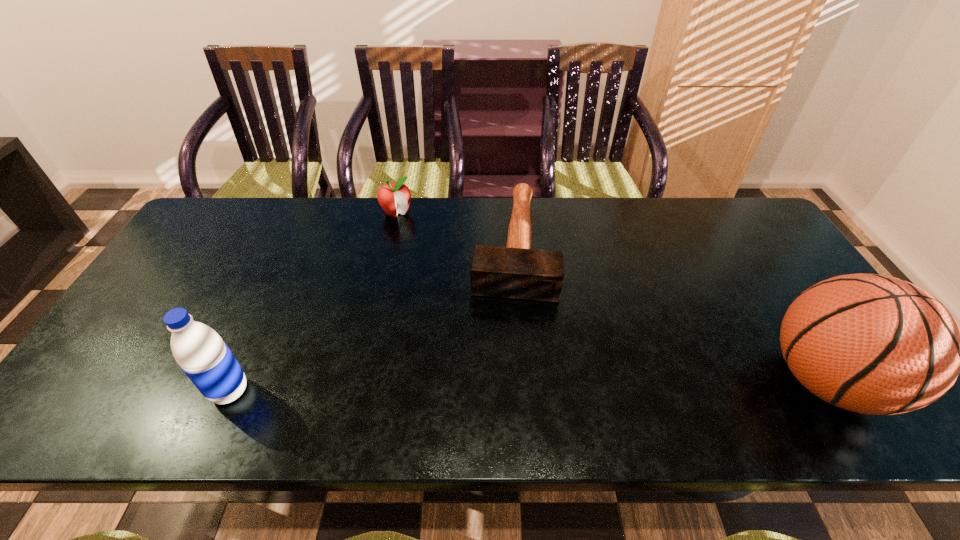
The image size is (960, 540). What are the coordinates of `vacant space on the desktop that is between the leftmost object and the basketball and is positioned on the striking face of the mallet` in the screenshot? It's located at (500, 386).

Locate an element on the screen. vacant space on the desktop that is between the water bottle and the basketball and is positioned on the side where a bite is taken out of the second object from left to right is located at coordinates (516, 386).